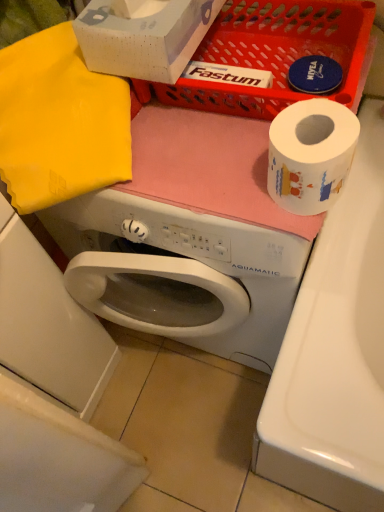
Question: Choose the correct answer: Is white glossy washing machine at lower left inside yellow fabric at upper left or outside it?

Choices:
 (A) outside
 (B) inside

Answer: (A)

Question: Is white glossy washing machine at lower left wider or thinner than yellow fabric at upper left?

Choices:
 (A) thin
 (B) wide

Answer: (A)

Question: Estimate the real-world distances between objects in this image. Which object is farther from the white matte toilet paper at upper right?

Choices:
 (A) yellow fabric at upper left
 (B) matte plastic basket at upper center
 (C) white matte washing machine at center
 (D) white glossy washing machine at lower left

Answer: (D)

Question: Estimate the real-world distances between objects in this image. Which object is farther from the yellow fabric at upper left?

Choices:
 (A) matte plastic basket at upper center
 (B) white glossy washing machine at lower left
 (C) white matte washing machine at center
 (D) white matte toilet paper at upper right

Answer: (D)